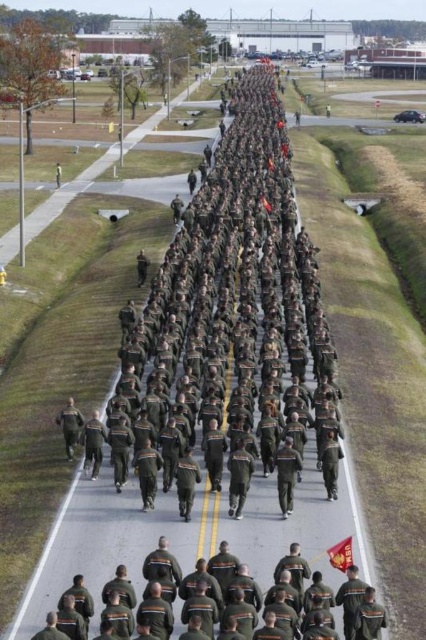
Is point (198, 634) positioned before point (328, 552)?

Yes, it is in front of point (328, 552).

Between dark green uniform at lower right and red fabric flag at center, which one is positioned higher?

Positioned higher is red fabric flag at center.

Who is more forward, (x=141, y=636) or (x=342, y=547)?

Point (x=141, y=636) is in front.

Where is `dark green uniform at lower right`? This screenshot has width=426, height=640. dark green uniform at lower right is located at coordinates (331, 605).